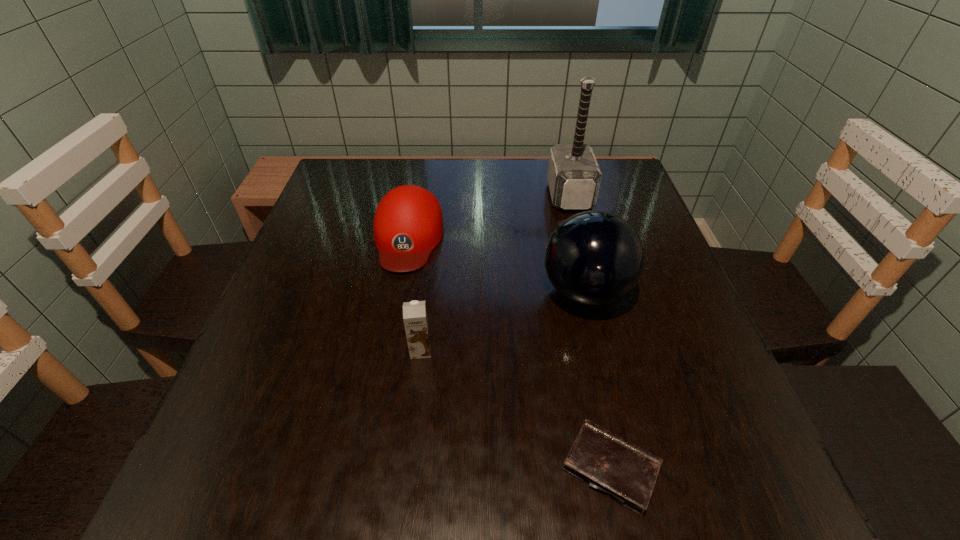
Where is `diary at the right edge`? This screenshot has height=540, width=960. diary at the right edge is located at coordinates (626, 473).

Identify the location of object located at the far right corner. This screenshot has width=960, height=540. (573, 176).

This screenshot has height=540, width=960. Identify the location of object at the near right corner. (626, 473).

The width and height of the screenshot is (960, 540). What are the coordinates of `vacant area at the far edge of the desktop` in the screenshot? It's located at (440, 178).

In the image, there is a desktop. Identify the location of vacant space at the near edge. This screenshot has width=960, height=540. (347, 463).

In the image, there is a desktop. At what (x,y) coordinates should I click in order to perform the action: click on vacant space at the left edge. Please return your answer as a coordinate pair (x, y). The height and width of the screenshot is (540, 960). Looking at the image, I should click on (x=331, y=375).

In the image, there is a desktop. At what (x,y) coordinates should I click in order to perform the action: click on free region at the right edge. Please return your answer as a coordinate pair (x, y). Image resolution: width=960 pixels, height=540 pixels. Looking at the image, I should click on (674, 315).

Locate an element on the screen. free space at the far right corner of the desktop is located at coordinates (607, 174).

The image size is (960, 540). Identify the location of vacant region between the chocolate milk and the second tallest object. (503, 321).

The width and height of the screenshot is (960, 540). Find the location of `empty space between the nearest object and the hammer`. empty space between the nearest object and the hammer is located at coordinates (590, 332).